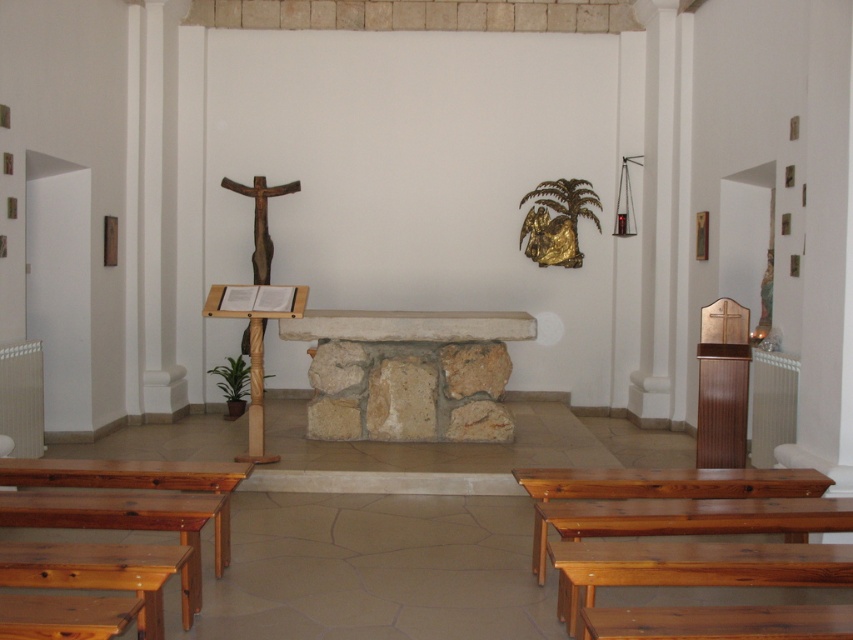
Who is more forward, (695, 492) or (250, 456)?

Point (695, 492) is more forward.

Locate an element on the screen. The image size is (853, 640). shiny brown wood bench at lower right is located at coordinates (668, 483).

Can you confirm if natural wood bench at lower left is positioned to the left of shiny brown wood bench at lower right?

Yes, natural wood bench at lower left is to the left of shiny brown wood bench at lower right.

Is natural wood bench at lower left shorter than shiny brown wood bench at lower right?

No, natural wood bench at lower left is not shorter than shiny brown wood bench at lower right.

Is point (222, 490) positioned behind point (670, 515)?

Yes, it is.

The height and width of the screenshot is (640, 853). What are the coordinates of `natural wood bench at lower left` in the screenshot? It's located at (128, 502).

Who is more distant from viewer, [102,518] or [265,189]?

Positioned behind is point [265,189].

Can you confirm if natural wood bench at lower left is positioned below wooden crucifix at left?

Yes, natural wood bench at lower left is below wooden crucifix at left.

Is point (152, 497) positioned after point (258, 362)?

No.

You are a GUI agent. You are given a task and a screenshot of the screen. Output one action in this format:
    pyautogui.click(x=<x>, y=<y>)
    Task: Click on the natural wood bench at lower left
    This screenshot has height=640, width=853.
    Given the screenshot: What is the action you would take?
    pyautogui.click(x=128, y=502)